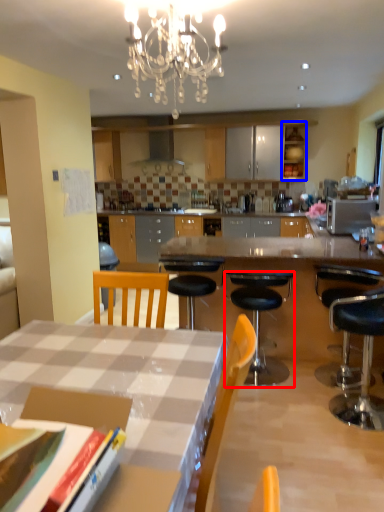
Question: Which object is further to the camera taking this photo, chair (highlighted by a red box) or cabinetry (highlighted by a blue box)?

Choices:
 (A) chair
 (B) cabinetry

Answer: (B)